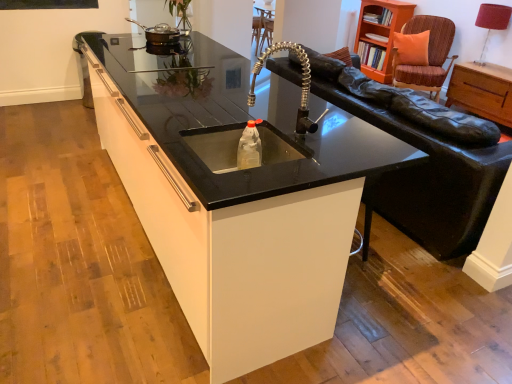
Question: From a real-world perspective, is red fabric lampshade at upper right positioned above or below black granite sink at center?

Choices:
 (A) above
 (B) below

Answer: (A)

Question: Is point (501, 9) closer or farther from the camera than point (292, 248)?

Choices:
 (A) farther
 (B) closer

Answer: (A)

Question: Estimate the real-world distances between objects in this image. Which object is closer to the orange wood bookshelf at upper right?

Choices:
 (A) translucent plastic bottle at center
 (B) brown woven swivel chair at upper right
 (C) black granite sink at center
 (D) satin nickel faucet at center
 (E) metallic silver pan at upper left

Answer: (B)

Question: Which object is positioned closest to the metallic silver pan at upper left?

Choices:
 (A) black granite sink at center
 (B) satin nickel faucet at center
 (C) orange wood bookshelf at upper right
 (D) red fabric lampshade at upper right
 (E) translucent plastic bottle at center

Answer: (B)